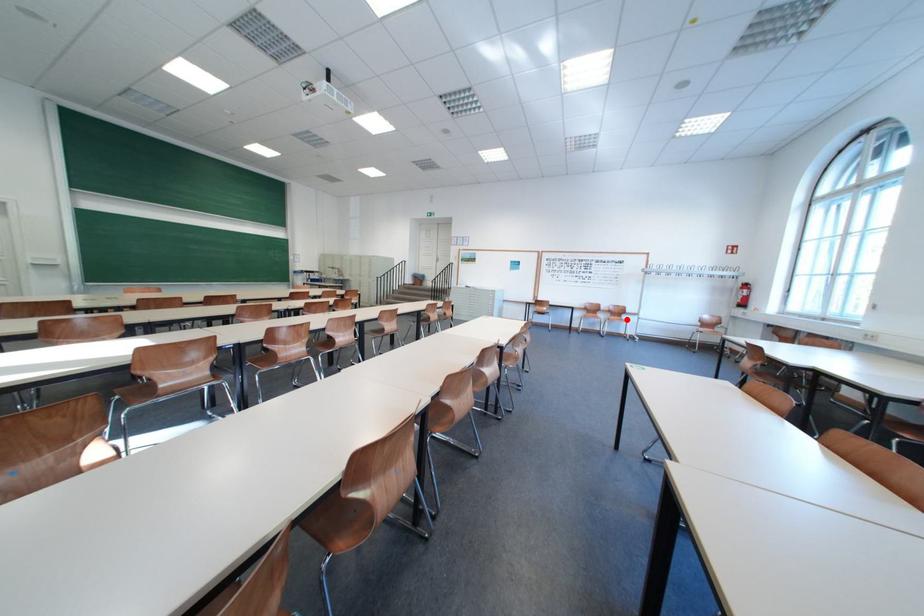
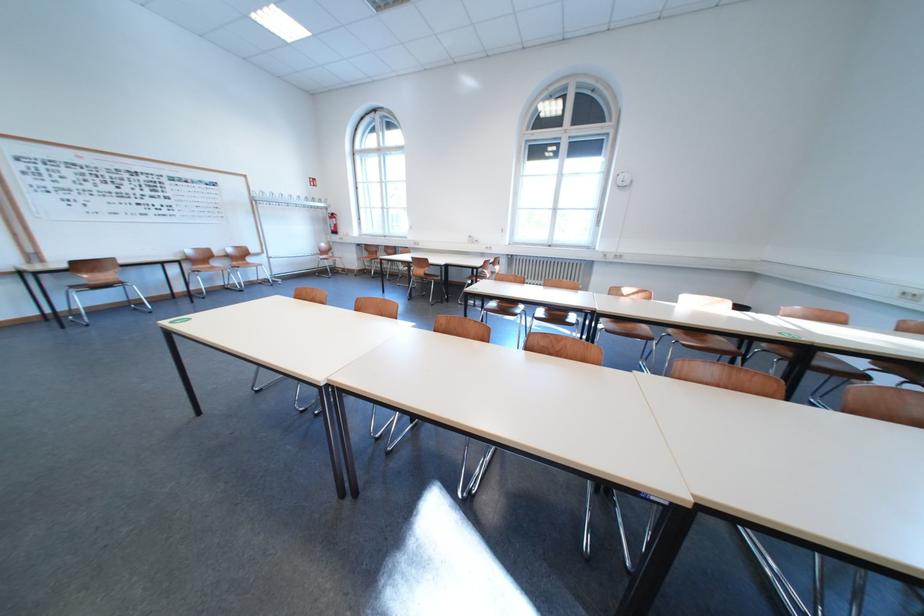
Question: I am providing you with two images of the same scene from different viewpoints. Image1 has a red point marked. In image2, the corresponding 3D location appears at what relative position? Reply with the corresponding letter.

Choices:
 (A) Closer
 (B) Farther

Answer: (A)